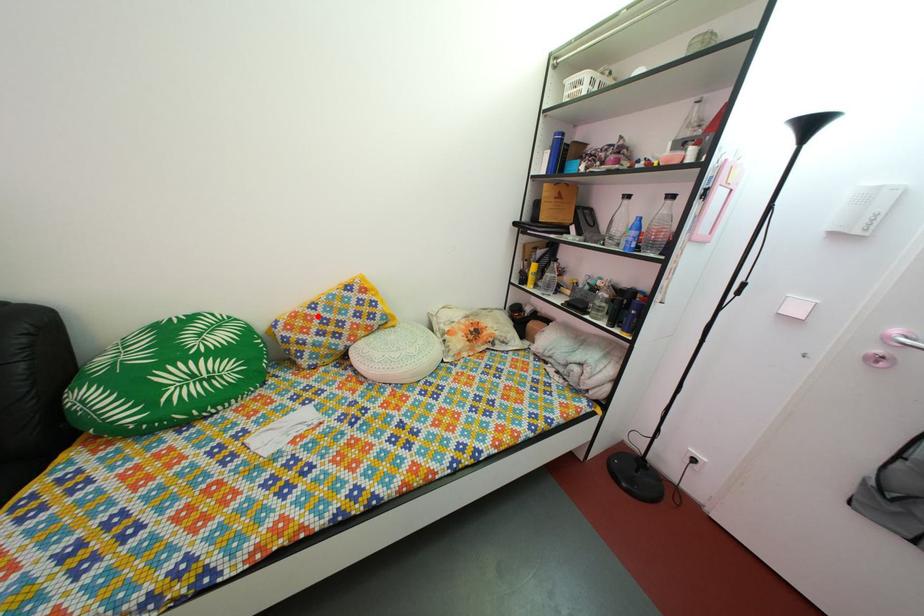
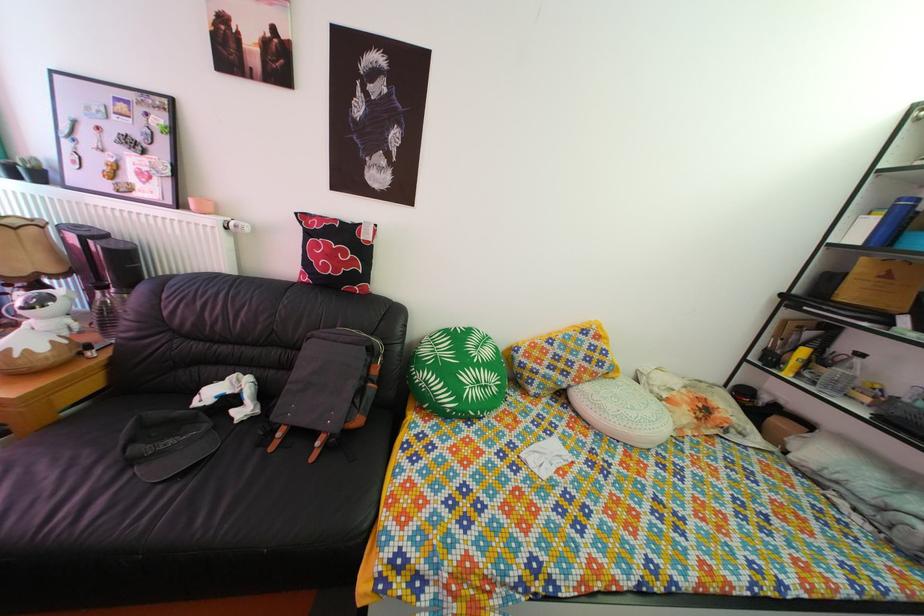
In the second image, find the point that corresponds to the highlighted location in the first image.

(555, 351)